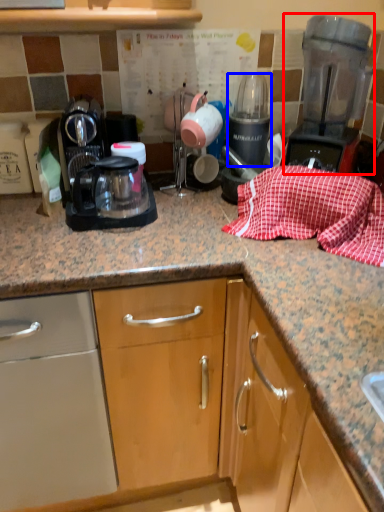
Question: Which of the following is the farthest to the observer, home appliance (highlighted by a red box) or appliance (highlighted by a blue box)?

Choices:
 (A) home appliance
 (B) appliance

Answer: (B)